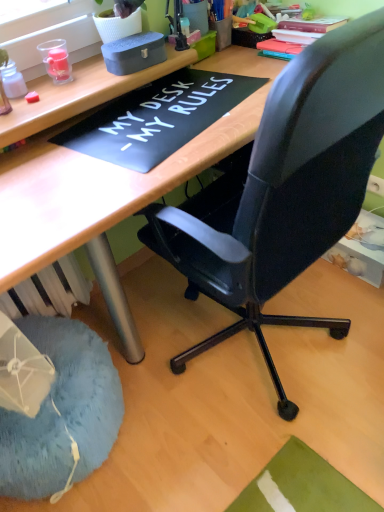
Question: Is wooden desk at center outside of matte gray box at upper center, the 2th stationery from the left?

Choices:
 (A) no
 (B) yes

Answer: (B)

Question: From the image's perspective, is wooden desk at center below matte gray box at upper center, the 2th stationery from the left?

Choices:
 (A) yes
 (B) no

Answer: (A)

Question: Is wooden desk at center positioned before matte gray box at upper center, the 2th stationery from the left?

Choices:
 (A) yes
 (B) no

Answer: (A)

Question: Can you confirm if wooden desk at center is shorter than matte gray box at upper center, the 2th stationery from the left?

Choices:
 (A) yes
 (B) no

Answer: (B)

Question: Does wooden desk at center have a larger size compared to matte gray box at upper center, positioned as the first stationery in right-to-left order?

Choices:
 (A) no
 (B) yes

Answer: (B)

Question: From a real-world perspective, is matte gray box at upper center, the 2th stationery from the left, physically located above or below blue fuzzy bean bag at lower left?

Choices:
 (A) above
 (B) below

Answer: (A)

Question: Which is correct: matte gray box at upper center, the 2th stationery from the left, is inside blue fuzzy bean bag at lower left, or outside of it?

Choices:
 (A) inside
 (B) outside

Answer: (B)

Question: Relative to blue fuzzy bean bag at lower left, is matte gray box at upper center, the 2th stationery from the left, in front or behind?

Choices:
 (A) behind
 (B) front

Answer: (A)

Question: Considering the positions of point (147, 52) and point (87, 417), is point (147, 52) closer or farther from the camera than point (87, 417)?

Choices:
 (A) farther
 (B) closer

Answer: (A)

Question: Is translucent plastic bottle at upper left, which is the second stationery from right to left, inside or outside of matte gray box at upper center, positioned as the first stationery in right-to-left order?

Choices:
 (A) outside
 (B) inside

Answer: (A)

Question: Is translucent plastic bottle at upper left, which is the second stationery from right to left, wider or thinner than matte gray box at upper center, positioned as the first stationery in right-to-left order?

Choices:
 (A) wide
 (B) thin

Answer: (B)

Question: Considering the relative positions of translucent plastic bottle at upper left, which is the second stationery from right to left, and matte gray box at upper center, the 2th stationery from the left, in the image provided, is translucent plastic bottle at upper left, which is the second stationery from right to left, to the left or to the right of matte gray box at upper center, the 2th stationery from the left,?

Choices:
 (A) right
 (B) left

Answer: (B)

Question: Considering the positions of point (14, 89) and point (158, 34), is point (14, 89) closer or farther from the camera than point (158, 34)?

Choices:
 (A) farther
 (B) closer

Answer: (B)

Question: From a real-world perspective, is wooden desk at center above or below translucent plastic bottle at upper left, which is the 1th stationery in left-to-right order?

Choices:
 (A) above
 (B) below

Answer: (B)

Question: Is point (6, 210) positioned closer to the camera than point (19, 88)?

Choices:
 (A) closer
 (B) farther

Answer: (A)